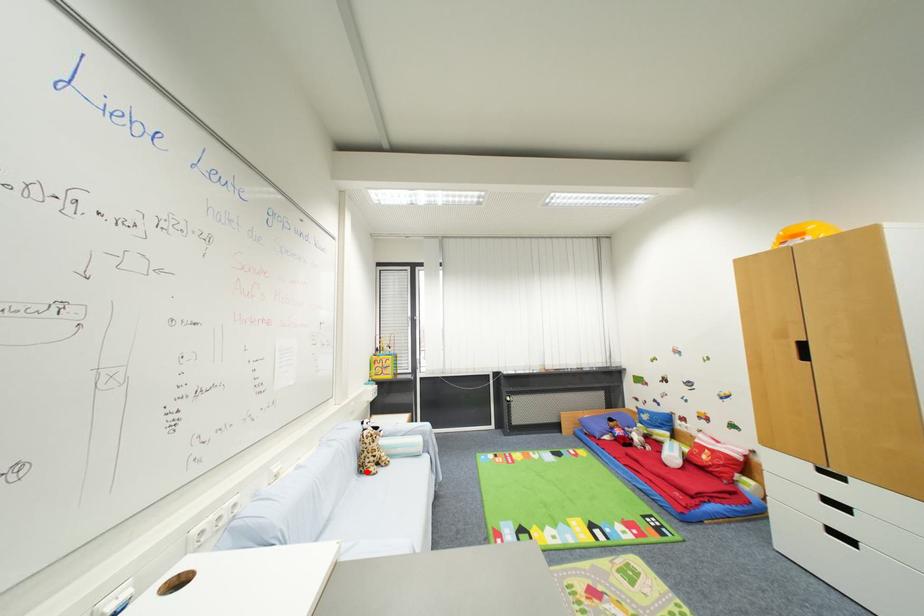
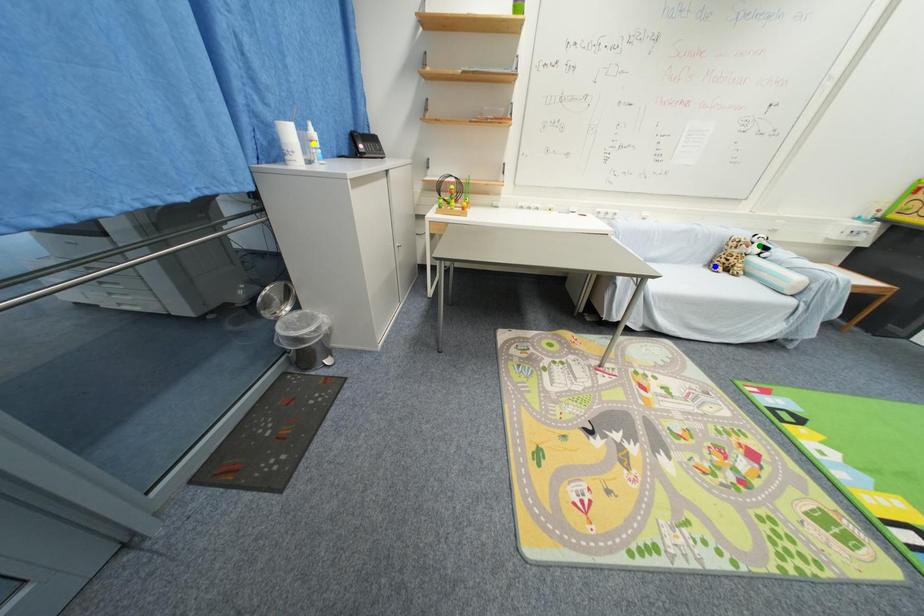
Question: I am providing you with two images of the same scene from different viewpoints. A red point is marked on the first image. You are given multiple points on the second image. In image 2, which mark is for the same physical point as the one in image 1?

Choices:
 (A) green point
 (B) blue point
 (C) yellow point

Answer: (B)